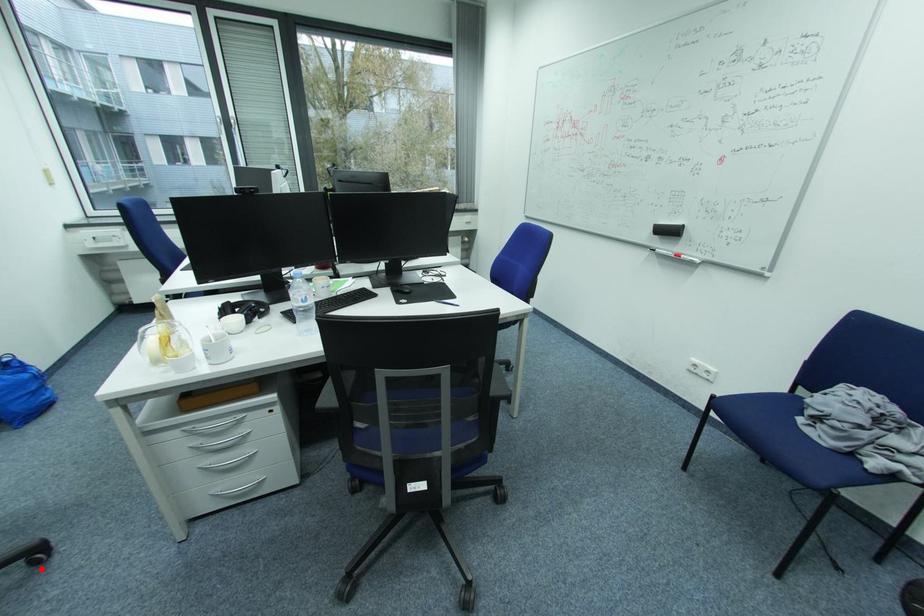
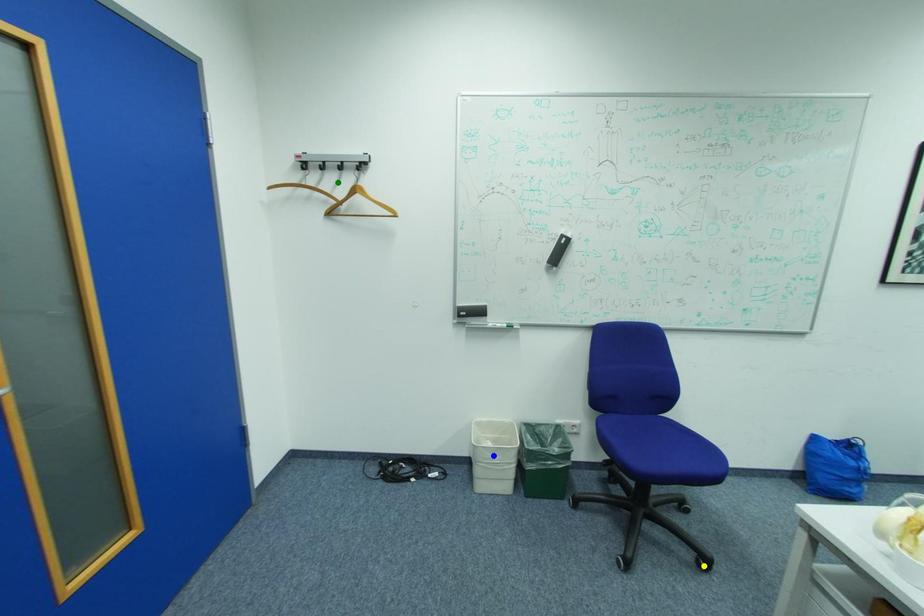
Question: I am providing you with two images of the same scene from different viewpoints. A red point is marked on the first image. You are given multiple points on the second image. Which mark in image 2 goes with the point in image 1?

Choices:
 (A) blue point
 (B) green point
 (C) yellow point

Answer: (C)